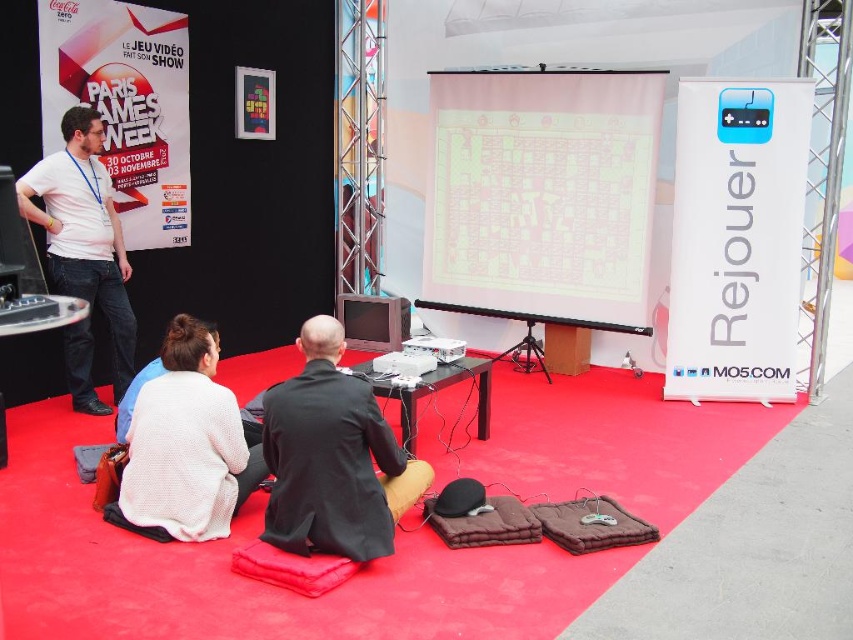
Looking at this image, can you confirm if black fabric at center is positioned below white plastic projector at center?

Yes, black fabric at center is below white plastic projector at center.

Can you confirm if black fabric at center is taller than white plastic projector at center?

Correct, black fabric at center is much taller as white plastic projector at center.

Image resolution: width=853 pixels, height=640 pixels. Identify the location of black fabric at center. (334, 458).

In order to click on black fabric at center in this screenshot , I will do `click(334, 458)`.

Between white matte shirt at left and white plastic projector at center, which one has less height?

white plastic projector at center is shorter.

Is point (103, 172) farther from camera compared to point (422, 346)?

Yes, it is.

Where is `white matte shirt at left`? This screenshot has width=853, height=640. white matte shirt at left is located at coordinates coord(83,230).

Locate an element on the screen. The image size is (853, 640). white matte shirt at left is located at coordinates (83, 230).

Who is taller, white matte projection screen at center or white matte shirt at left?

white matte projection screen at center

Which is in front, point (514, 198) or point (30, 211)?

Point (30, 211) is more forward.

The image size is (853, 640). I want to click on white matte projection screen at center, so tap(543, 195).